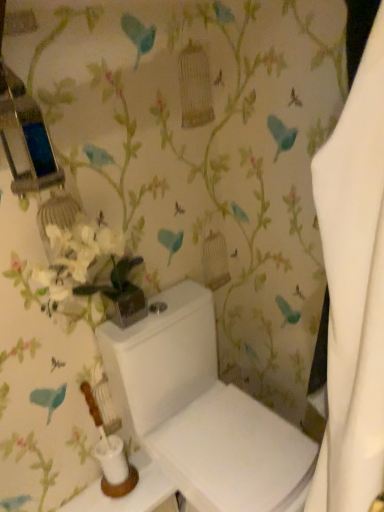
Question: Considering the positions of white glossy toilet tank at lower center and white glossy toilet at center in the image, is white glossy toilet tank at lower center bigger or smaller than white glossy toilet at center?

Choices:
 (A) big
 (B) small

Answer: (B)

Question: From the image's perspective, is white glossy toilet tank at lower center above or below white glossy toilet at center?

Choices:
 (A) above
 (B) below

Answer: (B)

Question: Is point (62, 509) closer or farther from the camera than point (127, 406)?

Choices:
 (A) closer
 (B) farther

Answer: (B)

Question: Would you say white glossy toilet at center is inside or outside white glossy toilet tank at lower center?

Choices:
 (A) outside
 (B) inside

Answer: (A)

Question: From the image's perspective, is white glossy toilet at center positioned above or below white glossy toilet tank at lower center?

Choices:
 (A) below
 (B) above

Answer: (B)

Question: Is white glossy toilet at center wider or thinner than white glossy toilet tank at lower center?

Choices:
 (A) thin
 (B) wide

Answer: (B)

Question: Is white glossy toilet at center bigger or smaller than white glossy toilet tank at lower center?

Choices:
 (A) big
 (B) small

Answer: (A)